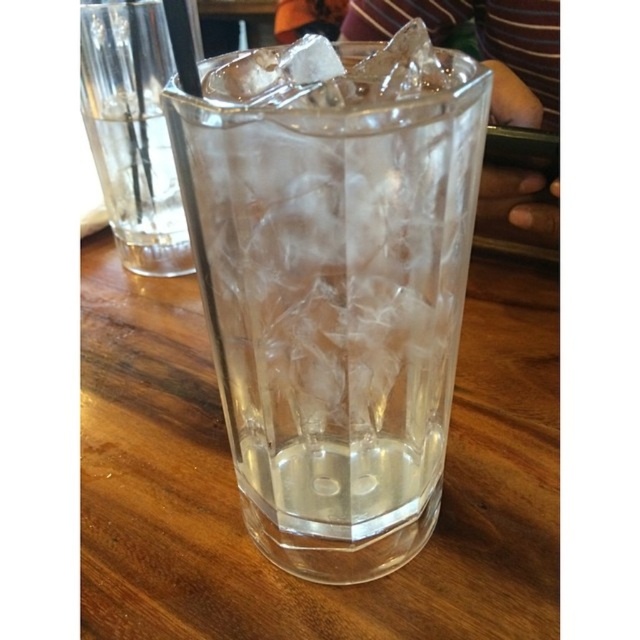
Question: Which of the following is the farthest from the observer?

Choices:
 (A) (429, 278)
 (B) (170, 134)

Answer: (A)

Question: Is transparent glass at center smaller than clear glass at left?

Choices:
 (A) yes
 (B) no

Answer: (A)

Question: Is transparent glass at center to the right of clear glass at left from the viewer's perspective?

Choices:
 (A) no
 (B) yes

Answer: (B)

Question: Among these objects, which one is nearest to the camera?

Choices:
 (A) transparent glass at center
 (B) clear glass at left

Answer: (A)

Question: Is transparent glass at center above clear glass at left?

Choices:
 (A) yes
 (B) no

Answer: (B)

Question: Which point is closer to the camera?

Choices:
 (A) (352, 186)
 (B) (136, 177)

Answer: (A)